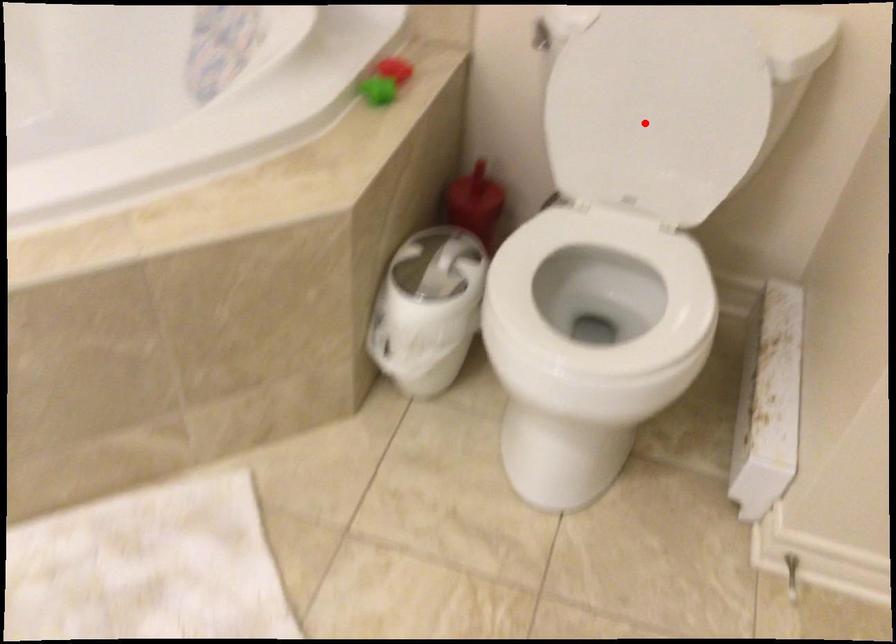
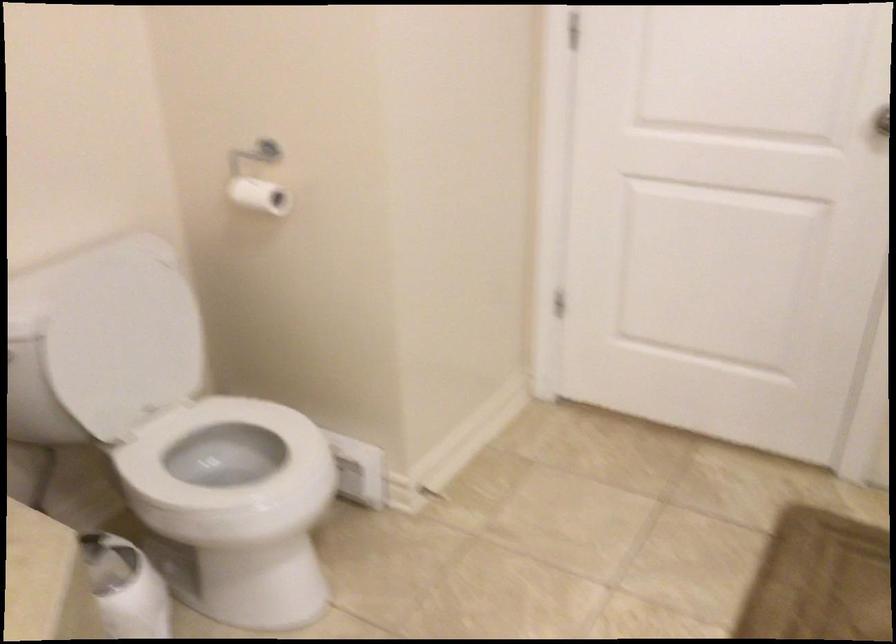
Question: I am providing you with two images of the same scene from different viewpoints. A red point is shown in image1. For the corresponding object point in image2, is it positioned nearer or farther from the camera?

Choices:
 (A) Nearer
 (B) Farther

Answer: (B)